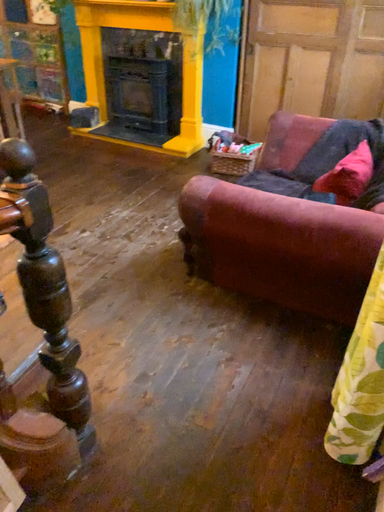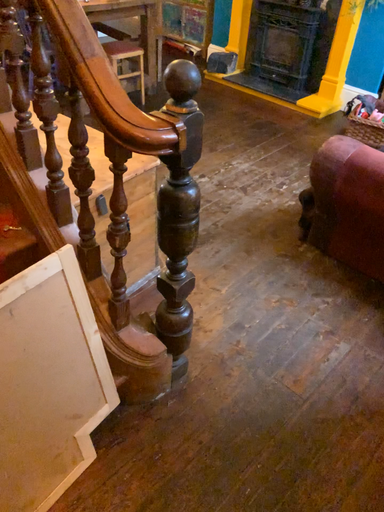
Question: How did the camera likely rotate when shooting the video?

Choices:
 (A) rotated left
 (B) rotated right

Answer: (A)